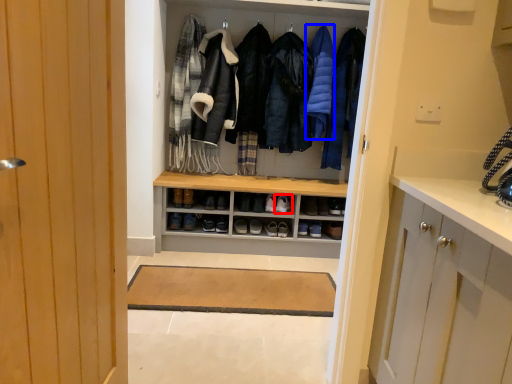
Question: Which object is further to the camera taking this photo, footwear (highlighted by a red box) or garment (highlighted by a blue box)?

Choices:
 (A) footwear
 (B) garment

Answer: (A)